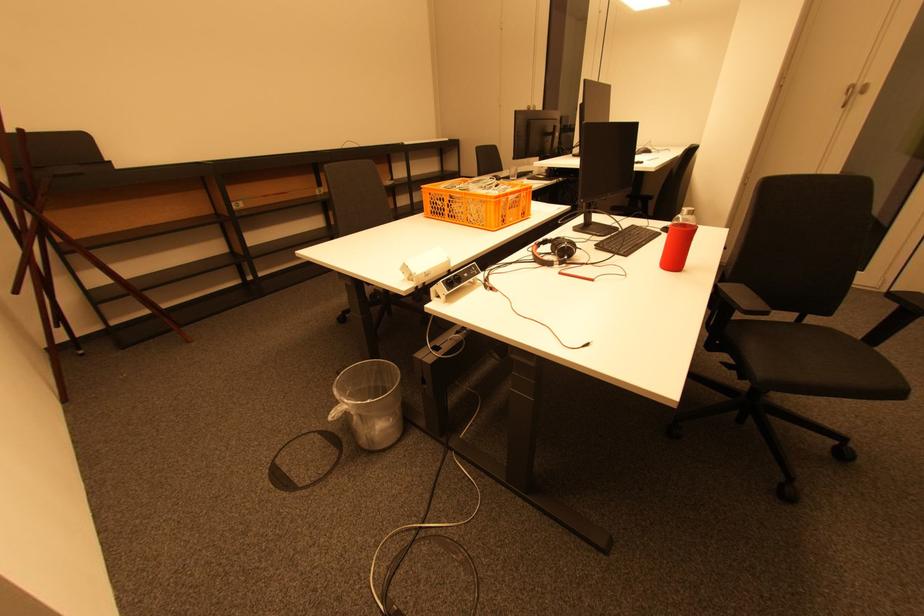
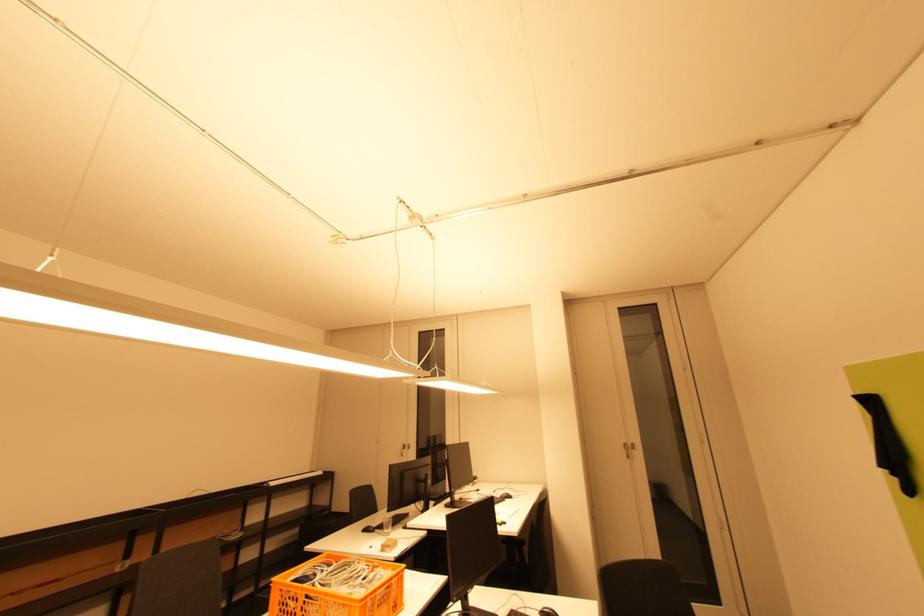
How did the camera likely rotate?

The rotation direction of the camera is right-up.